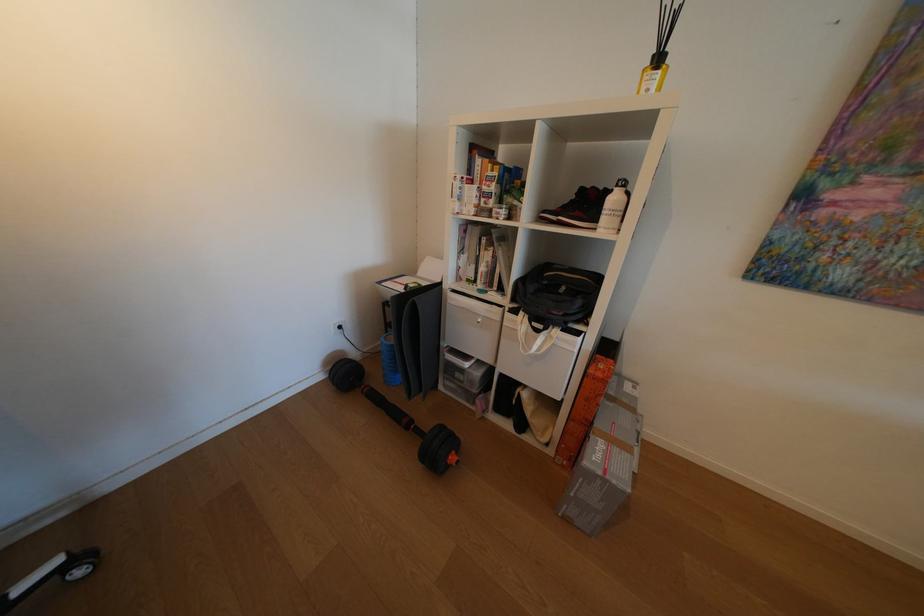
The width and height of the screenshot is (924, 616). What do you see at coordinates (614, 208) in the screenshot? I see `the white water bottle` at bounding box center [614, 208].